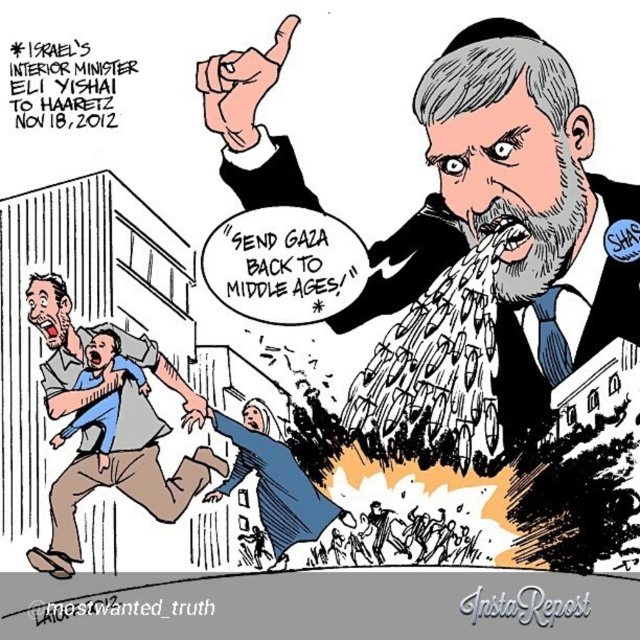
Question: Is gray textured beard at center below blue cotton shirt at lower left?

Choices:
 (A) no
 (B) yes

Answer: (A)

Question: Is gray textured beard at center positioned at the back of blue cotton shirt at lower left?

Choices:
 (A) yes
 (B) no

Answer: (A)

Question: Where is gray textured beard at center located in relation to blue cotton shirt at lower left in the image?

Choices:
 (A) right
 (B) left

Answer: (A)

Question: Which of the following is the closest to the observer?

Choices:
 (A) blue cotton shirt at lower left
 (B) gray textured beard at center

Answer: (A)

Question: Which point is farther to the camera?

Choices:
 (A) gray textured beard at center
 (B) blue cotton shirt at lower left

Answer: (A)